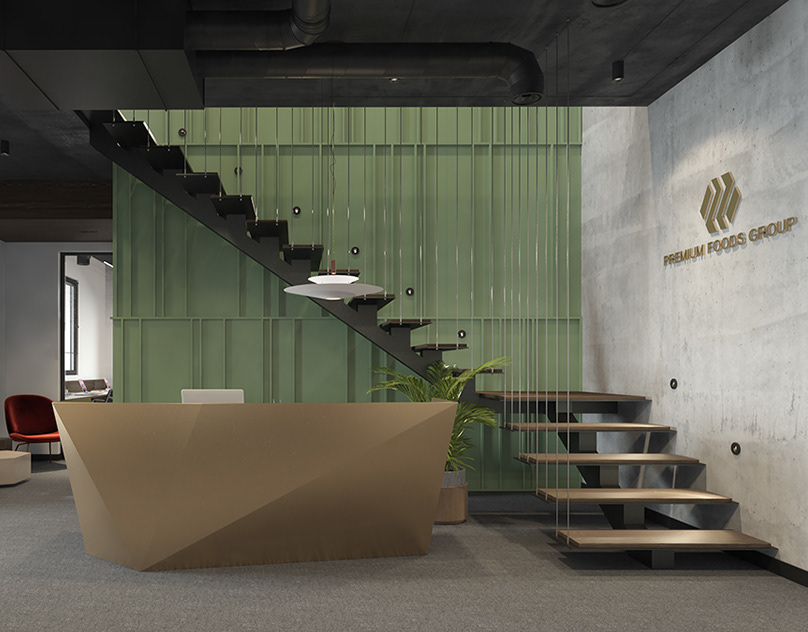
Where is `ceiling`? The width and height of the screenshot is (808, 632). ceiling is located at coordinates (424, 37).